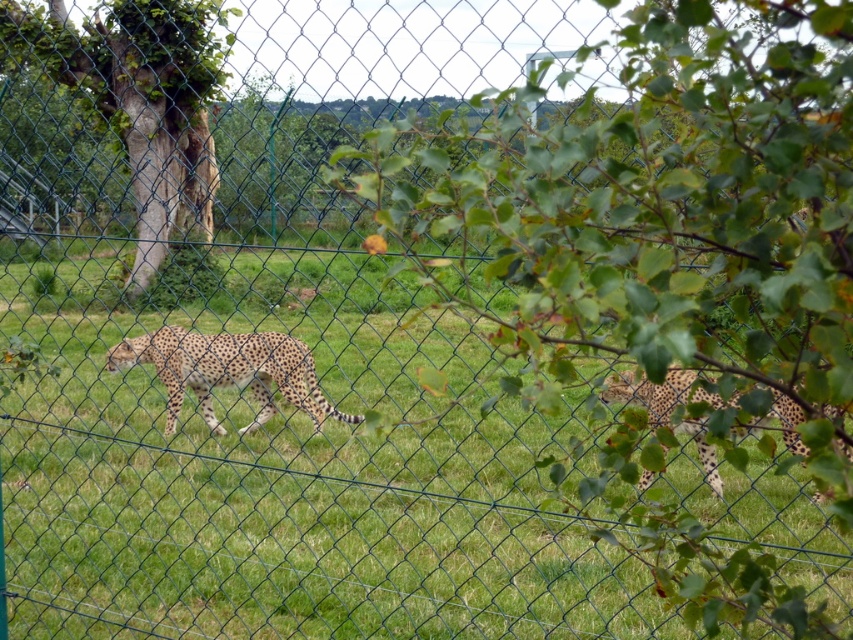
You are a zookeeper trying to locate two specific points in the enclosure. The first point is at coordinates point (144, 45) and the second is at point (712, 481). Which point is closer to the chain link fence that separates the animals from the visitors?

Point (144, 45) is closer to the chain link fence because it is further to the viewer than point (712, 481), meaning it is physically nearer to the fence barrier.

You are a zookeeper who needs to ensure the cheetahs have enough space to roam. Given that the minimum recommended distance between two cheetahs in an enclosure is 10 feet, does the current spacing between the spotted fur cheetah at center and the spotted fur cheetah at right meet this requirement?

The spotted fur cheetah at center is 13.46 feet from the spotted fur cheetah at right, which exceeds the minimum recommended distance of 10 feet, so yes, the current spacing meets the requirement.

You are a zookeeper planning to place a new feeding station in the enclosure. The station must be placed exactly at point (140, 100). What object is located at this coordinate?

The point (140, 100) marks the location of the green rough bark tree at left.